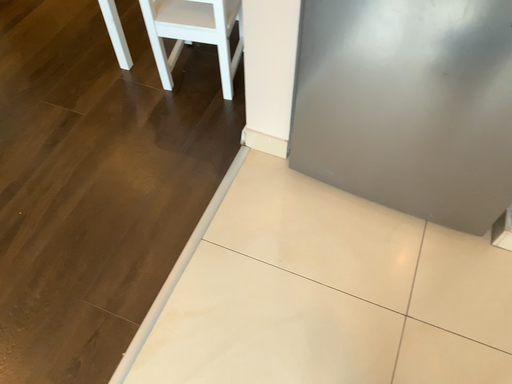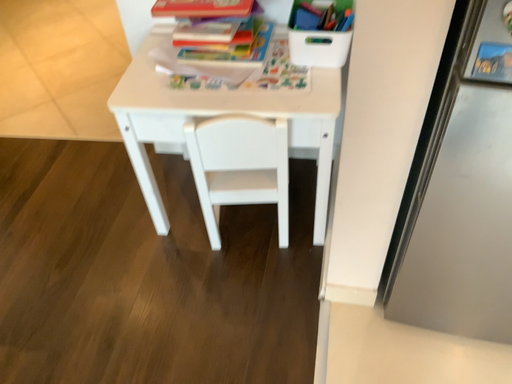
Question: How did the camera likely rotate when shooting the video?

Choices:
 (A) rotated upward
 (B) rotated downward

Answer: (A)